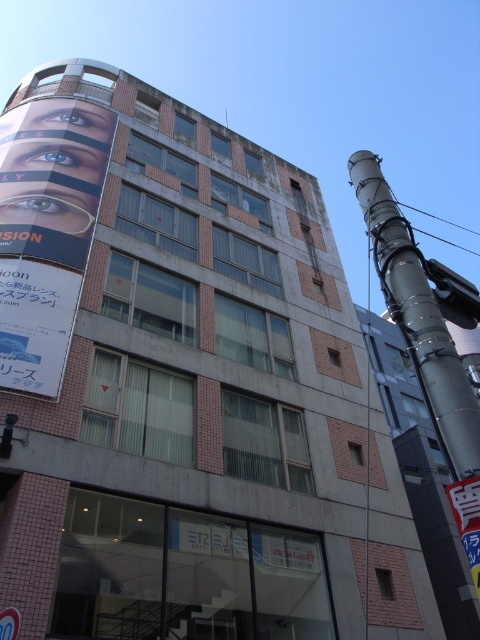
Question: Does matte black banner at upper left appear on the left side of white plastic sign at center?

Choices:
 (A) yes
 (B) no

Answer: (A)

Question: Which object is the farthest from the matte black banner at upper left?

Choices:
 (A) white plastic sign at center
 (B) metallic gray pole at right

Answer: (B)

Question: Considering the relative positions of matte black banner at upper left and metallic gray pole at right in the image provided, where is matte black banner at upper left located with respect to metallic gray pole at right?

Choices:
 (A) below
 (B) above

Answer: (B)

Question: Considering the real-world distances, which object is closest to the metallic gray pole at right?

Choices:
 (A) white plastic sign at center
 (B) matte black banner at upper left

Answer: (A)

Question: Does matte black banner at upper left come behind metallic gray pole at right?

Choices:
 (A) no
 (B) yes

Answer: (B)

Question: Which point is closer to the camera?

Choices:
 (A) (46, 154)
 (B) (409, 292)

Answer: (B)